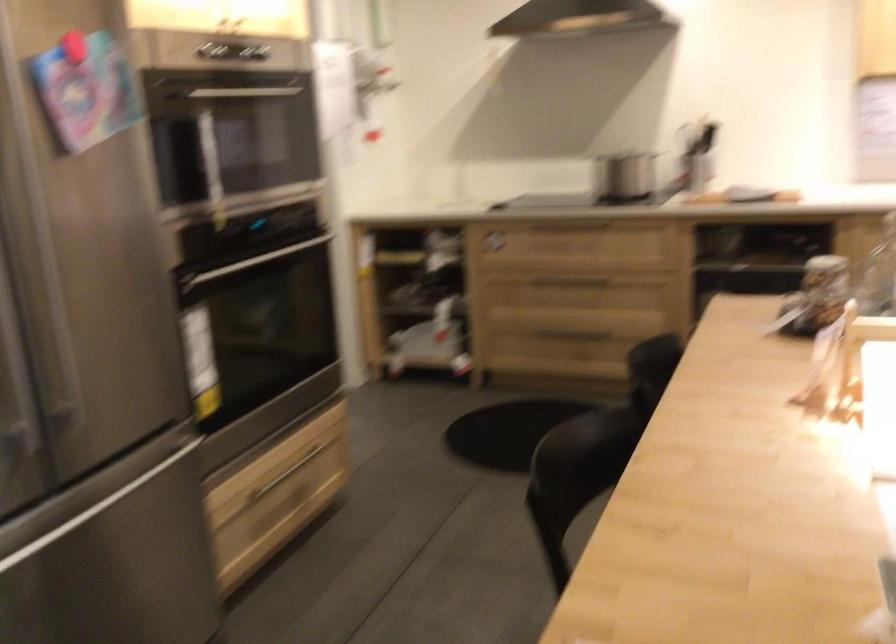
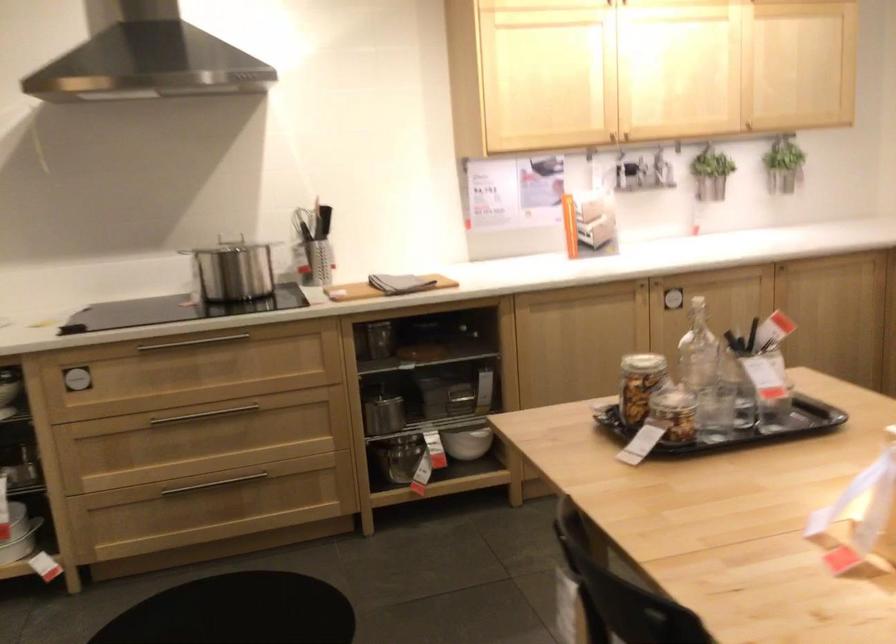
Find the pixel in the second image that matches (741,187) in the first image.

(388, 286)